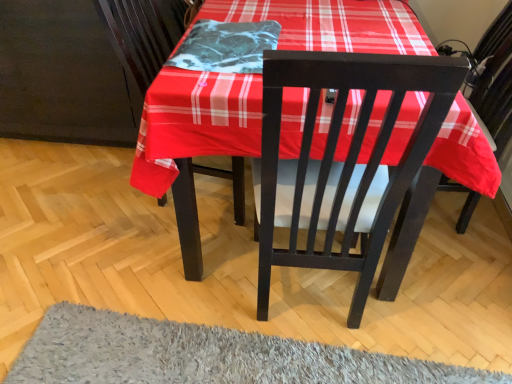
Question: Should I look upward or downward to see marble-like fabric at center?

Choices:
 (A) up
 (B) down

Answer: (A)

Question: Considering the relative sizes of marble-like fabric at center and gray shaggy rug at lower center in the image provided, is marble-like fabric at center wider than gray shaggy rug at lower center?

Choices:
 (A) yes
 (B) no

Answer: (B)

Question: Is marble-like fabric at center far away from gray shaggy rug at lower center?

Choices:
 (A) yes
 (B) no

Answer: (B)

Question: From a real-world perspective, is marble-like fabric at center on top of gray shaggy rug at lower center?

Choices:
 (A) no
 (B) yes

Answer: (B)

Question: Can you confirm if marble-like fabric at center is bigger than gray shaggy rug at lower center?

Choices:
 (A) yes
 (B) no

Answer: (B)

Question: Is marble-like fabric at center outside of gray shaggy rug at lower center?

Choices:
 (A) yes
 (B) no

Answer: (A)

Question: From the image's perspective, is marble-like fabric at center beneath gray shaggy rug at lower center?

Choices:
 (A) no
 (B) yes

Answer: (A)

Question: Is the surface of gray shaggy rug at lower center in direct contact with marble-like fabric at center?

Choices:
 (A) no
 (B) yes

Answer: (A)

Question: Would you say marble-like fabric at center is part of gray shaggy rug at lower center's contents?

Choices:
 (A) no
 (B) yes

Answer: (A)

Question: Is gray shaggy rug at lower center not inside marble-like fabric at center?

Choices:
 (A) no
 (B) yes

Answer: (B)

Question: Is gray shaggy rug at lower center aimed at marble-like fabric at center?

Choices:
 (A) yes
 (B) no

Answer: (B)

Question: From a real-world perspective, is gray shaggy rug at lower center under marble-like fabric at center?

Choices:
 (A) yes
 (B) no

Answer: (A)

Question: Is gray shaggy rug at lower center turned away from marble-like fabric at center?

Choices:
 (A) no
 (B) yes

Answer: (A)

Question: Considering the positions of point (79, 365) and point (204, 34), is point (79, 365) closer or farther from the camera than point (204, 34)?

Choices:
 (A) closer
 (B) farther

Answer: (A)